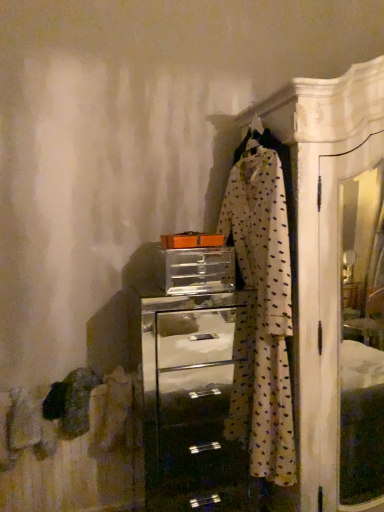
Question: Is metallic silver chest of drawers at center outside clear plastic drawer at center?

Choices:
 (A) yes
 (B) no

Answer: (A)

Question: Is metallic silver chest of drawers at center touching clear plastic drawer at center?

Choices:
 (A) yes
 (B) no

Answer: (B)

Question: Is metallic silver chest of drawers at center positioned with its back to clear plastic drawer at center?

Choices:
 (A) yes
 (B) no

Answer: (B)

Question: Is metallic silver chest of drawers at center at the right side of clear plastic drawer at center?

Choices:
 (A) yes
 (B) no

Answer: (A)

Question: Is metallic silver chest of drawers at center not near clear plastic drawer at center?

Choices:
 (A) yes
 (B) no

Answer: (A)

Question: From the image's perspective, is metallic silver chest of drawers at center on top of clear plastic drawer at center?

Choices:
 (A) yes
 (B) no

Answer: (B)

Question: Is clear plastic drawer at center oriented away from metallic silver chest of drawers at center?

Choices:
 (A) yes
 (B) no

Answer: (B)

Question: From the image's perspective, would you say clear plastic drawer at center is shown under metallic silver chest of drawers at center?

Choices:
 (A) no
 (B) yes

Answer: (A)

Question: Does clear plastic drawer at center have a smaller size compared to metallic silver chest of drawers at center?

Choices:
 (A) no
 (B) yes

Answer: (B)

Question: Are clear plastic drawer at center and metallic silver chest of drawers at center far apart?

Choices:
 (A) yes
 (B) no

Answer: (A)

Question: Is clear plastic drawer at center closer to the viewer compared to metallic silver chest of drawers at center?

Choices:
 (A) no
 (B) yes

Answer: (A)

Question: Would you say clear plastic drawer at center is outside metallic silver chest of drawers at center?

Choices:
 (A) yes
 (B) no

Answer: (A)

Question: Is metallic silver chest of drawers at center in contact with white dotted fabric at center?

Choices:
 (A) no
 (B) yes

Answer: (A)